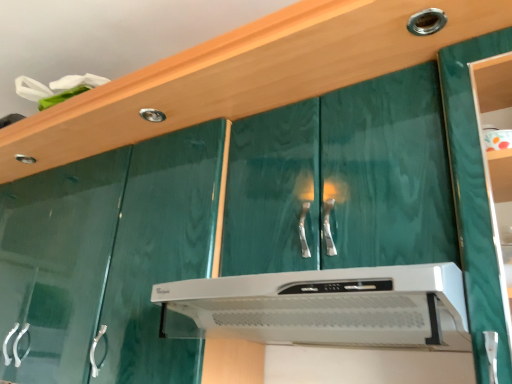
Question: Should I look upward or downward to see white plastic range hood at center?

Choices:
 (A) up
 (B) down

Answer: (B)

Question: From a real-world perspective, is metallic silver knob at upper right located beneath white plastic range hood at center?

Choices:
 (A) yes
 (B) no

Answer: (B)

Question: Considering the relative positions of metallic silver knob at upper right and white plastic range hood at center in the image provided, is metallic silver knob at upper right to the left of white plastic range hood at center from the viewer's perspective?

Choices:
 (A) yes
 (B) no

Answer: (B)

Question: Is the position of metallic silver knob at upper right more distant than that of white plastic range hood at center?

Choices:
 (A) no
 (B) yes

Answer: (B)

Question: Does metallic silver knob at upper right have a lesser height compared to white plastic range hood at center?

Choices:
 (A) yes
 (B) no

Answer: (A)

Question: Can we say metallic silver knob at upper right lies outside white plastic range hood at center?

Choices:
 (A) yes
 (B) no

Answer: (A)

Question: Is metallic silver knob at upper right taller than white plastic range hood at center?

Choices:
 (A) yes
 (B) no

Answer: (B)

Question: Is metallic silver knob at upper right surrounded by white plastic range hood at center?

Choices:
 (A) yes
 (B) no

Answer: (B)

Question: Is white plastic range hood at center touching metallic silver knob at upper right?

Choices:
 (A) yes
 (B) no

Answer: (B)

Question: Does white plastic range hood at center turn towards metallic silver knob at upper right?

Choices:
 (A) no
 (B) yes

Answer: (A)

Question: Is white plastic range hood at center not within metallic silver knob at upper right?

Choices:
 (A) yes
 (B) no

Answer: (A)

Question: Can you confirm if white plastic range hood at center is bigger than metallic silver knob at upper right?

Choices:
 (A) no
 (B) yes

Answer: (B)

Question: Does white plastic range hood at center have a greater height compared to metallic silver knob at upper right?

Choices:
 (A) yes
 (B) no

Answer: (A)

Question: Is white plastic range hood at center bigger or smaller than metallic silver knob at upper right?

Choices:
 (A) big
 (B) small

Answer: (A)